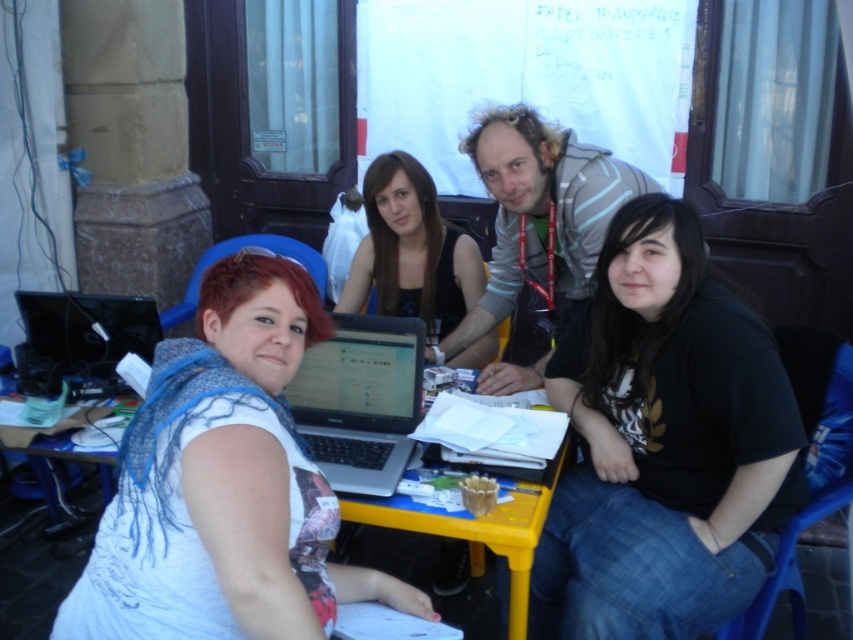
Question: Can you confirm if silver metallic laptop at center is positioned below silver metallic laptop at left?

Choices:
 (A) no
 (B) yes

Answer: (B)

Question: Is yellow plastic table at lower center to the right of silver metallic laptop at center from the viewer's perspective?

Choices:
 (A) no
 (B) yes

Answer: (A)

Question: Which point is farther from the camera taking this photo?

Choices:
 (A) (28, 332)
 (B) (578, 166)

Answer: (A)

Question: Which is nearer to the yellow plastic table at lower center?

Choices:
 (A) black matte shirt at lower right
 (B) silver metallic laptop at left
 (C) silver metallic laptop at center

Answer: (B)

Question: Which object is farther from the camera taking this photo?

Choices:
 (A) yellow plastic table at lower center
 (B) silver metallic laptop at left
 (C) matte black laptop at center

Answer: (C)

Question: Is black matte shirt at lower right wider than silver metallic laptop at left?

Choices:
 (A) no
 (B) yes

Answer: (B)